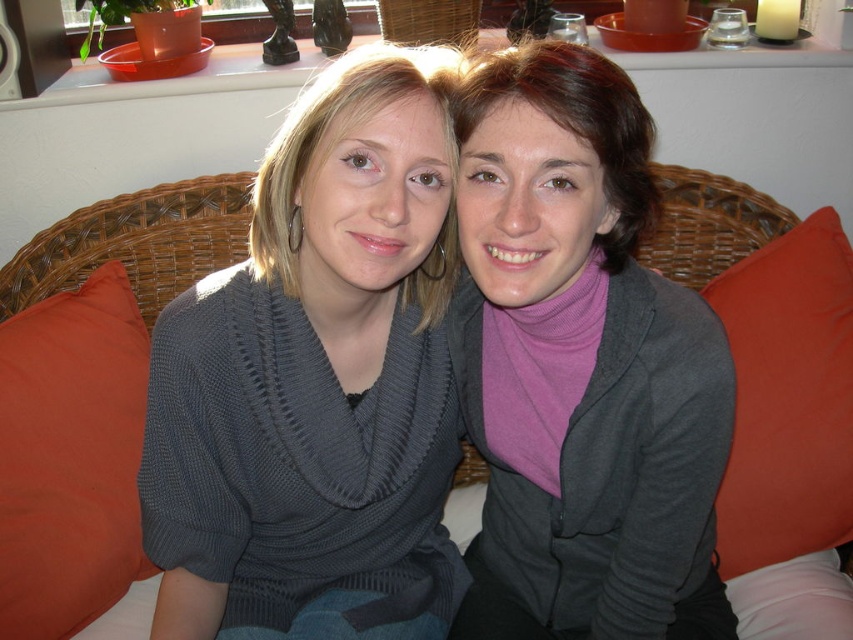
You are a photographer standing at a distance of 30 inches from the scene. You want to take a photo where the gray knit sweater at center is in focus. Is the sweater within your camera focus range if your camera can focus as close as 29.74 inches?

The gray knit sweater at center is exactly 29.74 inches away from the camera, which matches the minimum focus distance of your camera. Therefore, the sweater will be in focus.

You are a photographer adjusting your camera settings. You notice the gray knit sweater at center and the orange fabric pillow at left in your frame. Which object should you focus on to ensure the subject in front is sharp?

The gray knit sweater at center is closer to the viewer than the orange fabric pillow at left, so focusing on the gray knit sweater at center will ensure the subject in front is sharp.

You are a tailor measuring clothing for a customer. You need to determine if the purple matte turtleneck at center can be placed on the woven wicker couch at center without slipping off. The minimum required distance between the clothing and the edge of the couch is 20 inches for stability. Can the turtleneck be placed safely?

The distance between the purple matte turtleneck at center and the woven wicker couch at center is 17.19 inches, which is less than the required 20 inches. Therefore, placing the turtleneck there may cause it to slip off, so it is not safe.